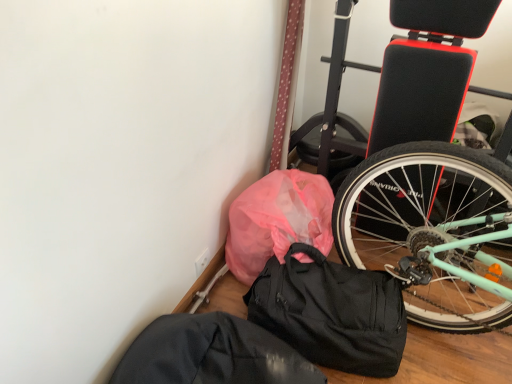
Question: Should I look upward or downward to see pink plastic bag at lower left?

Choices:
 (A) down
 (B) up

Answer: (A)

Question: Can you confirm if black matte duffel bag at lower center is positioned to the right of black fabric sack at lower center?

Choices:
 (A) no
 (B) yes

Answer: (B)

Question: Is black fabric sack at lower center a part of black matte duffel bag at lower center?

Choices:
 (A) yes
 (B) no

Answer: (B)

Question: Can you confirm if black matte duffel bag at lower center is shorter than black fabric sack at lower center?

Choices:
 (A) no
 (B) yes

Answer: (A)

Question: Are black matte duffel bag at lower center and black fabric sack at lower center far apart?

Choices:
 (A) no
 (B) yes

Answer: (A)

Question: Does black matte duffel bag at lower center have a smaller size compared to black fabric sack at lower center?

Choices:
 (A) no
 (B) yes

Answer: (B)

Question: Could you tell me if black matte duffel bag at lower center is facing black fabric sack at lower center?

Choices:
 (A) no
 (B) yes

Answer: (A)

Question: Is black fabric sack at lower center taller than black matte duffel bag at lower center?

Choices:
 (A) no
 (B) yes

Answer: (A)

Question: Can you confirm if black fabric sack at lower center is thinner than black matte duffel bag at lower center?

Choices:
 (A) yes
 (B) no

Answer: (B)

Question: Can black matte duffel bag at lower center be found inside black fabric sack at lower center?

Choices:
 (A) no
 (B) yes

Answer: (A)

Question: Is black fabric sack at lower center further to camera compared to black matte duffel bag at lower center?

Choices:
 (A) no
 (B) yes

Answer: (A)

Question: Is black fabric sack at lower center to the left of black matte duffel bag at lower center from the viewer's perspective?

Choices:
 (A) no
 (B) yes

Answer: (B)

Question: Considering the relative positions of black fabric sack at lower center and black matte duffel bag at lower center in the image provided, is black fabric sack at lower center in front of black matte duffel bag at lower center?

Choices:
 (A) yes
 (B) no

Answer: (A)

Question: From the image's perspective, is pink plastic bag at lower left beneath black fabric sack at lower center?

Choices:
 (A) no
 (B) yes

Answer: (A)